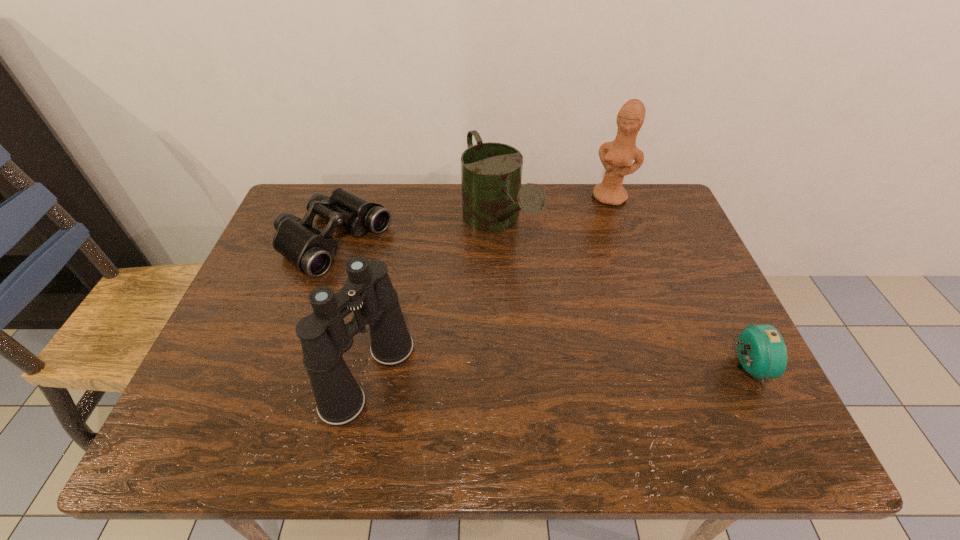
You are a GUI agent. You are given a task and a screenshot of the screen. Output one action in this format:
    pyautogui.click(x=<x>, y=<y>)
    Task: Click on the vacant space situated on the front-facing side of the figurine
    The image size is (960, 540).
    Given the screenshot: What is the action you would take?
    pyautogui.click(x=592, y=234)

Image resolution: width=960 pixels, height=540 pixels. What are the coordinates of `free space located on the front-facing side of the figurine` in the screenshot? It's located at (575, 267).

Find the location of a particular element. The height and width of the screenshot is (540, 960). vacant region located 0.280m on the front-facing side of the figurine is located at coordinates (577, 265).

At what (x,y) coordinates should I click in order to perform the action: click on vacant space situated on the front-facing side of the shorter binoculars. Please return your answer as a coordinate pair (x, y). Image resolution: width=960 pixels, height=540 pixels. Looking at the image, I should click on pyautogui.click(x=444, y=309).

Find the location of a particular element. The height and width of the screenshot is (540, 960). free space located 0.200m on the front-facing side of the shorter binoculars is located at coordinates (429, 300).

The image size is (960, 540). I want to click on free spot located 0.330m on the front-facing side of the shorter binoculars, so click(x=470, y=325).

Identify the location of watering can that is at the far edge. (491, 173).

Locate an element on the screen. The image size is (960, 540). figurine present at the far edge is located at coordinates (617, 157).

Locate an element on the screen. Image resolution: width=960 pixels, height=540 pixels. binoculars located in the far edge section of the desktop is located at coordinates (309, 250).

The height and width of the screenshot is (540, 960). What are the coordinates of `binoculars at the near edge` in the screenshot? It's located at (368, 291).